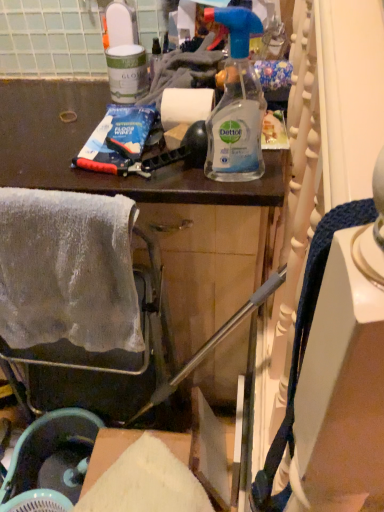
Locate an element on the screen. vacant region to the left of white matte paper towel at center is located at coordinates (82, 147).